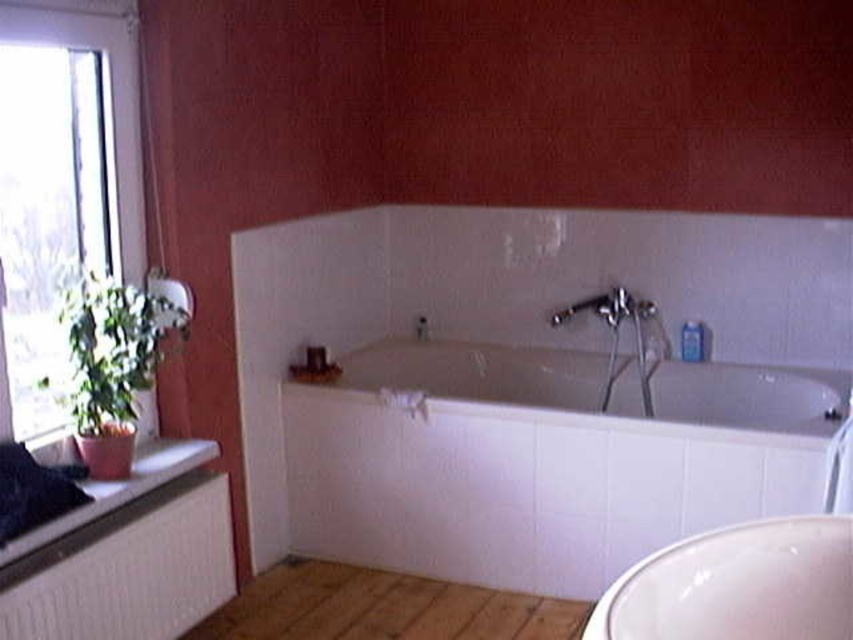
Does white textured radiator at lower left have a smaller size compared to matte silver faucet at center?

No, white textured radiator at lower left is not smaller than matte silver faucet at center.

Between white textured radiator at lower left and matte silver faucet at center, which one is positioned lower?

white textured radiator at lower left

The width and height of the screenshot is (853, 640). What do you see at coordinates (128, 570) in the screenshot? I see `white textured radiator at lower left` at bounding box center [128, 570].

The width and height of the screenshot is (853, 640). What are the coordinates of `white textured radiator at lower left` in the screenshot? It's located at (128, 570).

Can you confirm if brown wood floor at lower center is thinner than transparent glass window at left?

No.

Who is more distant from viewer, (347, 577) or (138, 150)?

The point (347, 577) is more distant.

Identify the location of brown wood floor at lower center. (381, 608).

Does point (840, 563) come behind point (358, 624)?

No, it is in front of (358, 624).

What do you see at coordinates (737, 586) in the screenshot?
I see `white glossy sink at lower right` at bounding box center [737, 586].

The height and width of the screenshot is (640, 853). I want to click on white glossy sink at lower right, so click(x=737, y=586).

The image size is (853, 640). I want to click on white glossy sink at lower right, so click(737, 586).